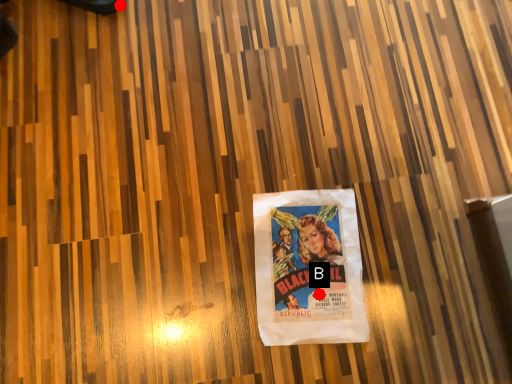
Question: Two points are circled on the image, labeled by A and B beside each circle. Which point is closer to the camera taking this photo?

Choices:
 (A) A is closer
 (B) B is closer

Answer: (B)